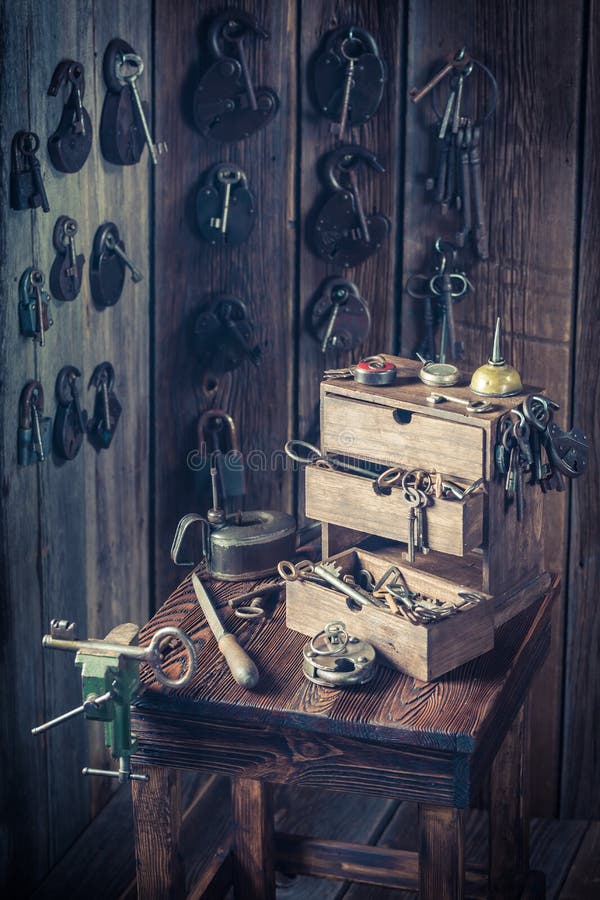
This screenshot has height=900, width=600. In order to click on sunlight on wooden wall in this screenshot , I will do `click(555, 328)`.